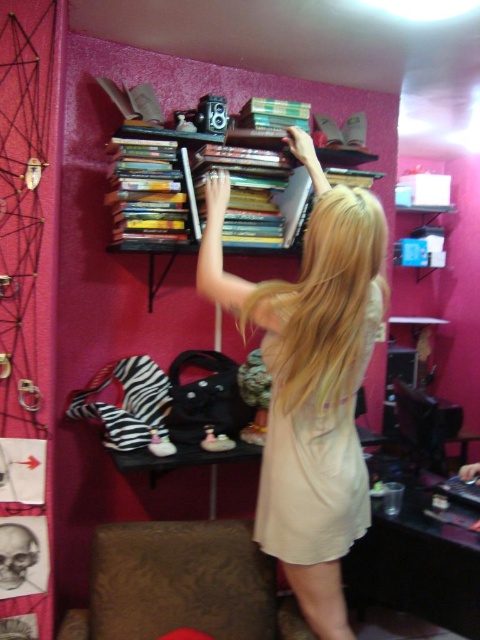
You are a guest in this room and want to sit down on the brown textured couch at lower left. Is there enough space for the matte beige dress at center to be placed on the couch without moving anything?

The matte beige dress at center is bigger than brown textured couch at lower left, so it won not fit on the couch without moving something.

You are a guest in this room and want to sit down on the brown textured couch at lower left. However, there is a matte beige dress at center in the way. Can you walk around the dress to reach the couch?

The matte beige dress at center is much taller than the brown textured couch at lower left, so it might block your path. You may need to move the dress aside or find another route to reach the couch.